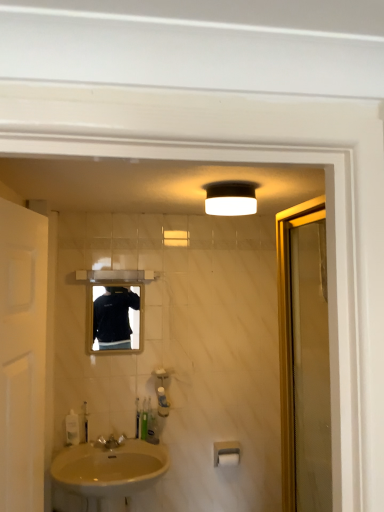
What are the coordinates of `vacant space situated on the left part of silver metallic faucet at lower center` in the screenshot? It's located at (77, 449).